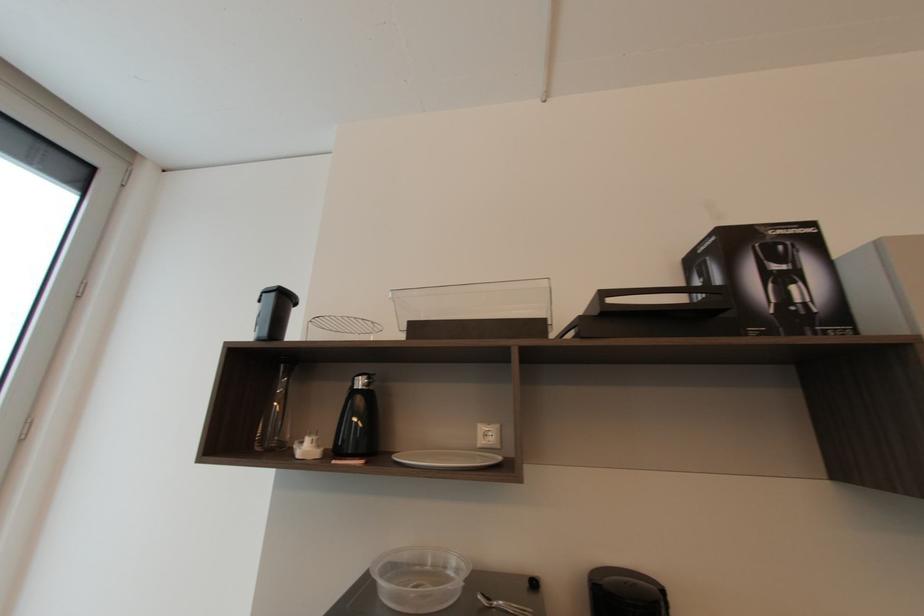
Which object does [773,278] point to?

It corresponds to the black cardboard box in the image.